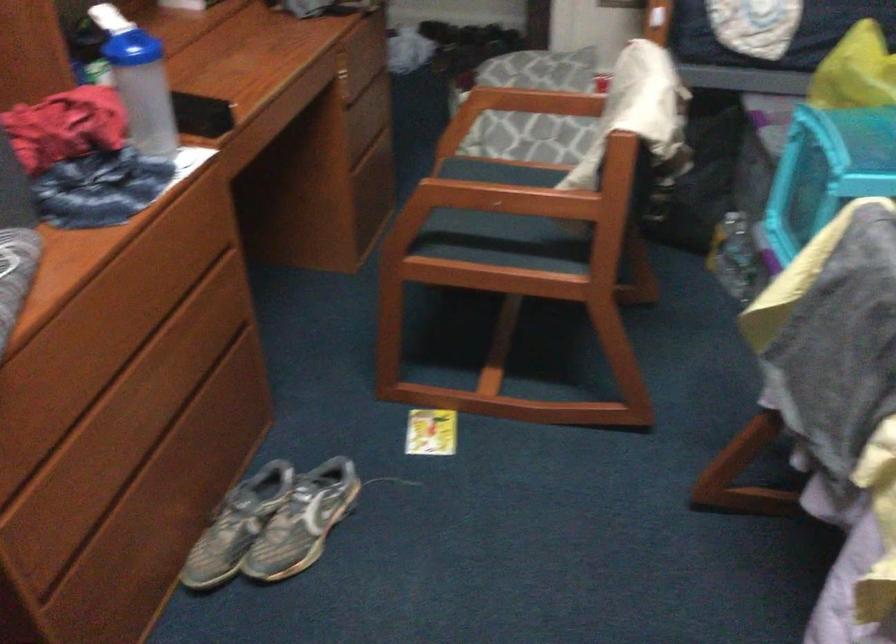
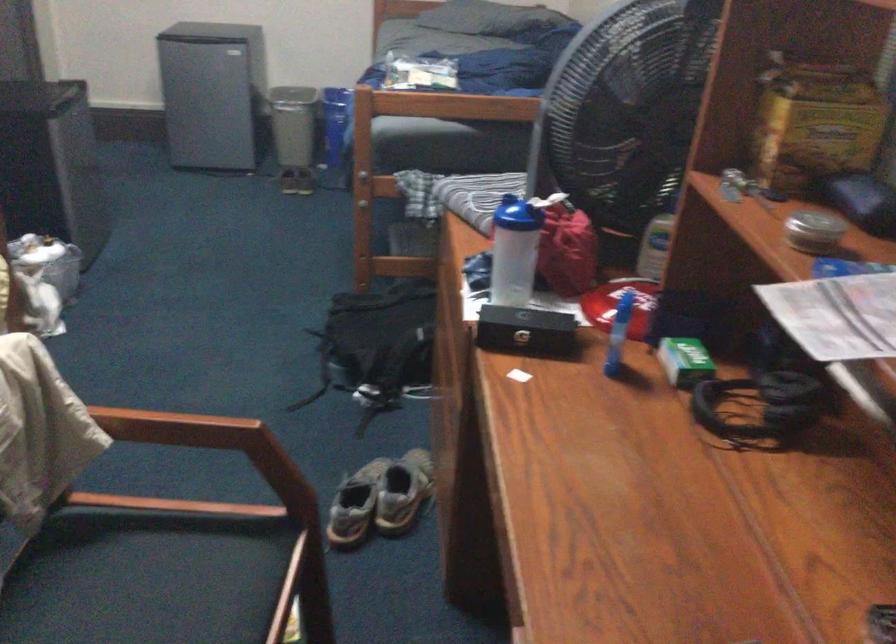
Where in the second image is the point corresponding to (x=512, y=212) from the first image?

(162, 579)